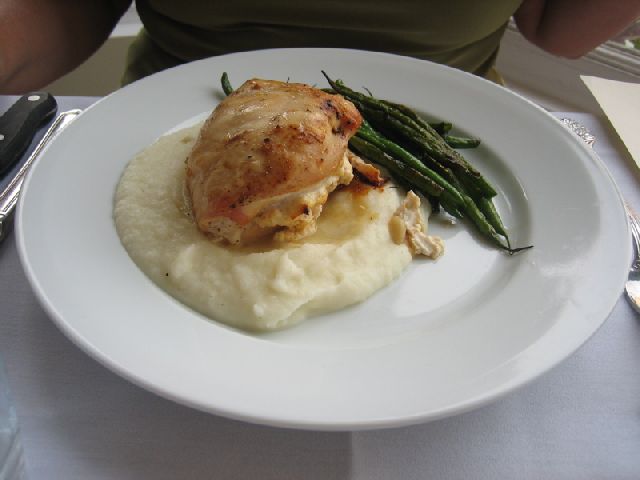
Where is `table`? table is located at coordinates (121, 475).